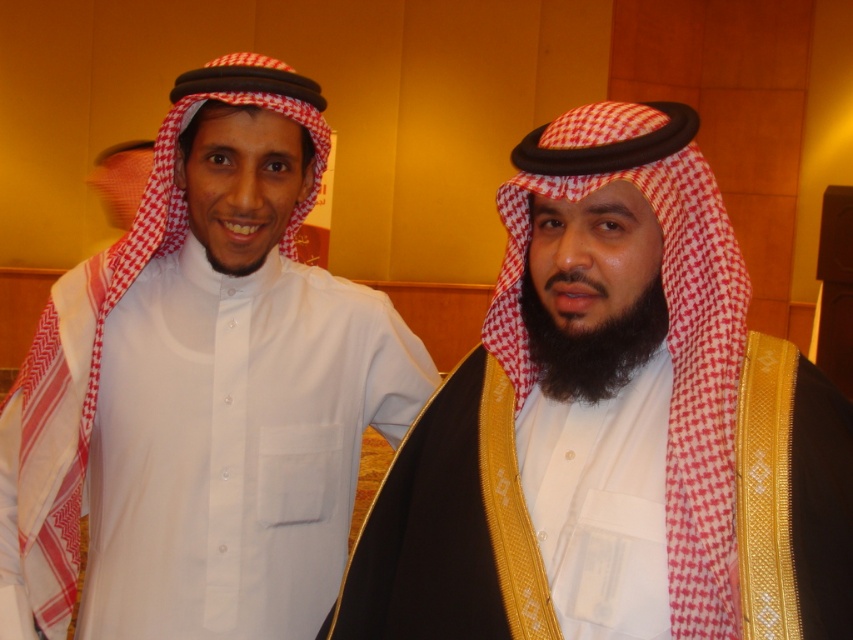
Question: Which point appears farthest from the camera in this image?

Choices:
 (A) (701, 593)
 (B) (163, 324)

Answer: (B)

Question: Which point appears closest to the camera in this image?

Choices:
 (A) (699, 572)
 (B) (91, 596)

Answer: (A)

Question: Observing the image, what is the correct spatial positioning of white fabric headscarf at right in reference to white matte shirt at center?

Choices:
 (A) below
 (B) above

Answer: (A)

Question: Is white fabric headscarf at right to the right of white matte shirt at center from the viewer's perspective?

Choices:
 (A) yes
 (B) no

Answer: (A)

Question: Which point is closer to the camera?

Choices:
 (A) white fabric headscarf at right
 (B) white matte shirt at center

Answer: (A)

Question: Considering the relative positions of white fabric headscarf at right and white matte shirt at center in the image provided, where is white fabric headscarf at right located with respect to white matte shirt at center?

Choices:
 (A) below
 (B) above

Answer: (A)